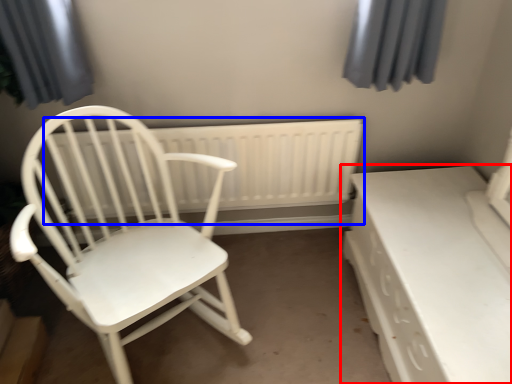
Question: Which of the following is the closest to the observer, table (highlighted by a red box) or radiator (highlighted by a blue box)?

Choices:
 (A) table
 (B) radiator

Answer: (A)